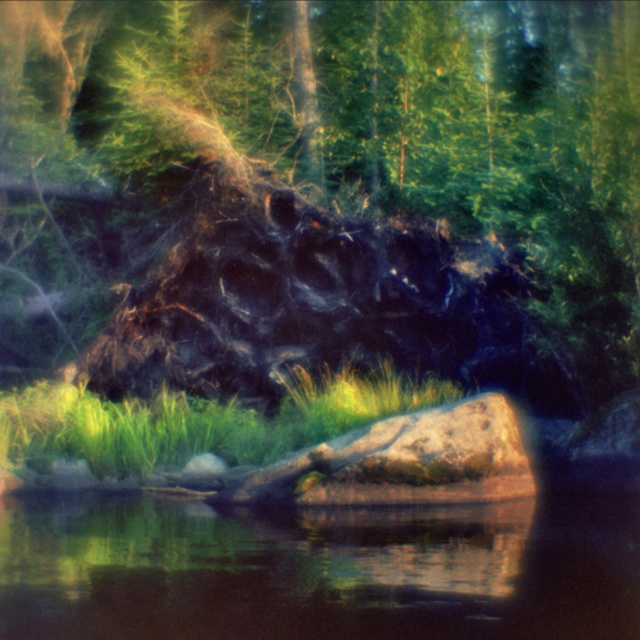
Between point (115, 182) and point (298, 369), which one is positioned in front?

Point (298, 369) is more forward.

Who is more distant from viewer, (480, 284) or (387, 378)?

Positioned behind is point (480, 284).

You are a GUI agent. You are given a task and a screenshot of the screen. Output one action in this format:
    pyautogui.click(x=<x>, y=<y>)
    Task: Click on the charcoal textured log at center
    The height and width of the screenshot is (640, 640).
    Given the screenshot: What is the action you would take?
    pyautogui.click(x=321, y=193)